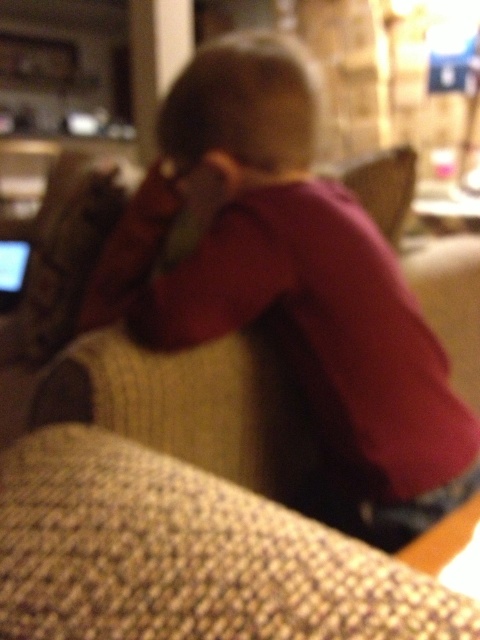
Does knitted beige couch at center appear under matte black laptop at left?

Yes, knitted beige couch at center is below matte black laptop at left.

Measure the distance from knitted beige couch at center to matte black laptop at left.

36.68 inches

Does point (50, 544) come in front of point (7, 301)?

Yes, point (50, 544) is in front of point (7, 301).

Where is `knitted beige couch at center`? The height and width of the screenshot is (640, 480). knitted beige couch at center is located at coordinates (186, 556).

Is pink fabric shirt at center above knitted beige couch at center?

Yes, pink fabric shirt at center is above knitted beige couch at center.

Describe the element at coordinates (288, 280) in the screenshot. Image resolution: width=480 pixels, height=640 pixels. I see `pink fabric shirt at center` at that location.

Find the location of a particular element. The image size is (480, 640). pink fabric shirt at center is located at coordinates (288, 280).

Which is above, pink fabric shirt at center or matte black laptop at left?

matte black laptop at left is above.

Describe the element at coordinates (288, 280) in the screenshot. I see `pink fabric shirt at center` at that location.

Identify the location of pink fabric shirt at center. tap(288, 280).